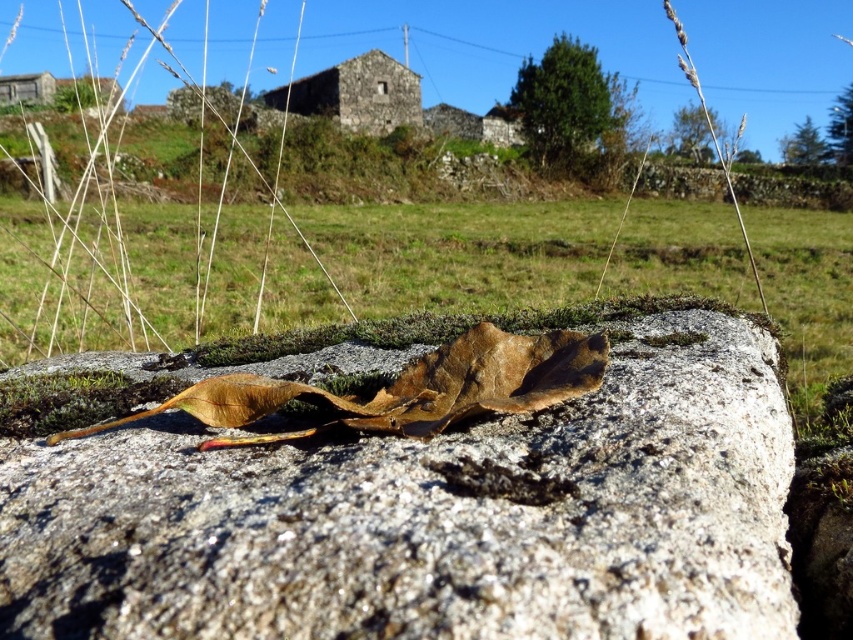
Is granite rock at center to the right of green grass at center from the viewer's perspective?

Indeed, granite rock at center is positioned on the right side of green grass at center.

Who is more distant from viewer, [225,586] or [723,272]?

Positioned behind is point [723,272].

Find the location of a particular element. The width and height of the screenshot is (853, 640). granite rock at center is located at coordinates (430, 516).

Does green grass at center have a greater width compared to brown papery leaf at center?

Yes.

What do you see at coordinates (462, 253) in the screenshot? The image size is (853, 640). I see `green grass at center` at bounding box center [462, 253].

Locate an element on the screen. This screenshot has height=640, width=853. green grass at center is located at coordinates (462, 253).

Who is more forward, (x=210, y=497) or (x=341, y=422)?

Point (x=210, y=497) is in front.

Can you confirm if granite rock at center is positioned above brown papery leaf at center?

Incorrect, granite rock at center is not positioned above brown papery leaf at center.

Is point (531, 586) less distant than point (576, 358)?

That is True.

You are a GUI agent. You are given a task and a screenshot of the screen. Output one action in this format:
    pyautogui.click(x=<x>, y=<y>)
    Task: Click on the granite rock at center
    The height and width of the screenshot is (640, 853).
    Given the screenshot: What is the action you would take?
    pyautogui.click(x=430, y=516)